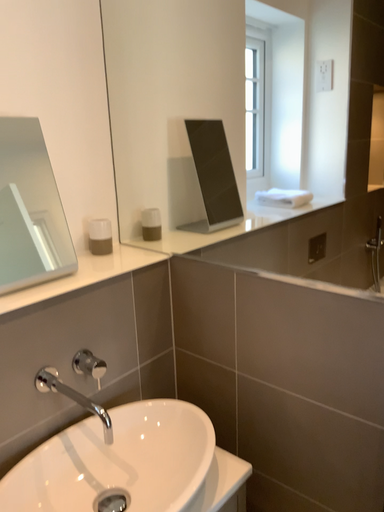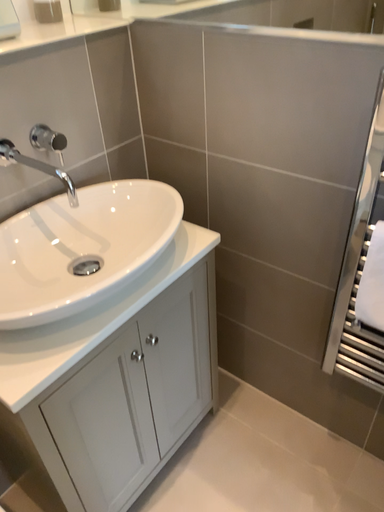
Question: Which way did the camera rotate in the video?

Choices:
 (A) rotated downward
 (B) rotated upward

Answer: (A)